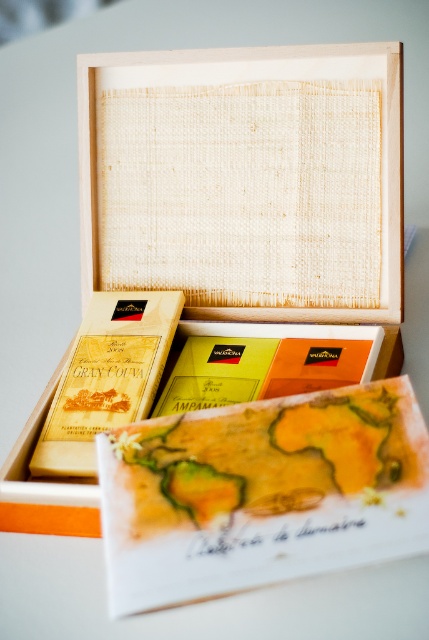
You are organizing a picnic and have both the wooden box at center and the watercolor paper map at center. Which item should you place in your backpack first to ensure the other fits on top?

The wooden box at center is taller than the watercolor paper map at center, so you should place the wooden box at center in your backpack first. This allows the shorter watercolor paper map at center to fit on top without exceeding the backpack height limit.

You are organizing items on a shelf and need to place both the wooden box at center and the watercolor paper map at center. Based on their positions in the image, which item should you place first to maintain the original arrangement?

The wooden box at center is to the left of watercolor paper map at center, so you should place the wooden box at center first to maintain the original arrangement.

You are organizing a picnic basket and have both the wooden box at center and the watercolor paper map at center. Which item can you fit into the basket first if the opening is narrow and you need to prioritize the wider item?

The wooden box at center is wider than the watercolor paper map at center, so you should place the wooden box at center first to ensure it fits through the narrow opening.